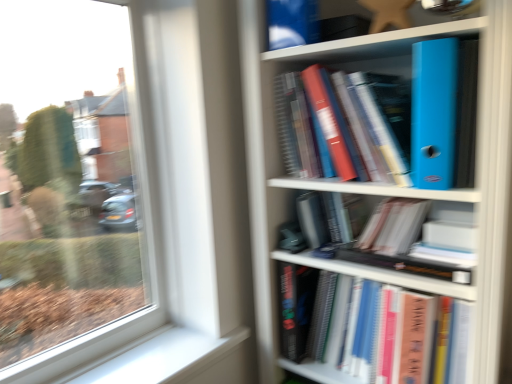
Question: Is white smooth window sill at lower left spatially inside hardcover book at center, which is the second book from top to bottom, or outside of it?

Choices:
 (A) inside
 (B) outside

Answer: (B)

Question: From the image's perspective, is white smooth window sill at lower left positioned above or below hardcover book at center, which is the 1th book in bottom-to-top order?

Choices:
 (A) below
 (B) above

Answer: (A)

Question: Which of these objects is positioned closest to the matte plastic bookcase at right?

Choices:
 (A) hardcover book at center, which is the second book from top to bottom
 (B) blue plastic folder at upper right, marked as the second book in a bottom-to-top arrangement
 (C) white smooth window sill at lower left

Answer: (B)

Question: Based on their relative distances, which object is farther from the matte plastic bookcase at right?

Choices:
 (A) blue plastic folder at upper right, marked as the second book in a bottom-to-top arrangement
 (B) white smooth window sill at lower left
 (C) hardcover book at center, which is the second book from top to bottom

Answer: (B)